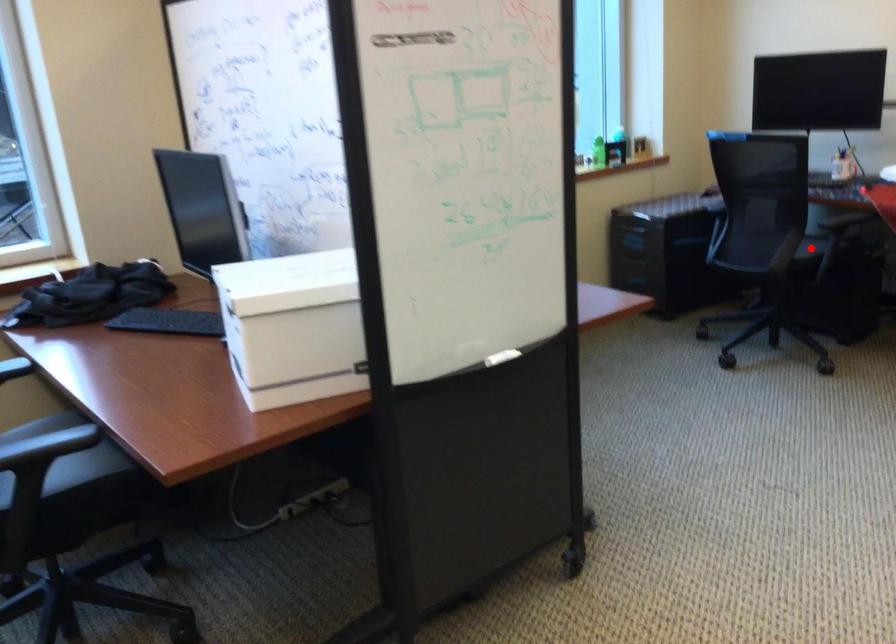
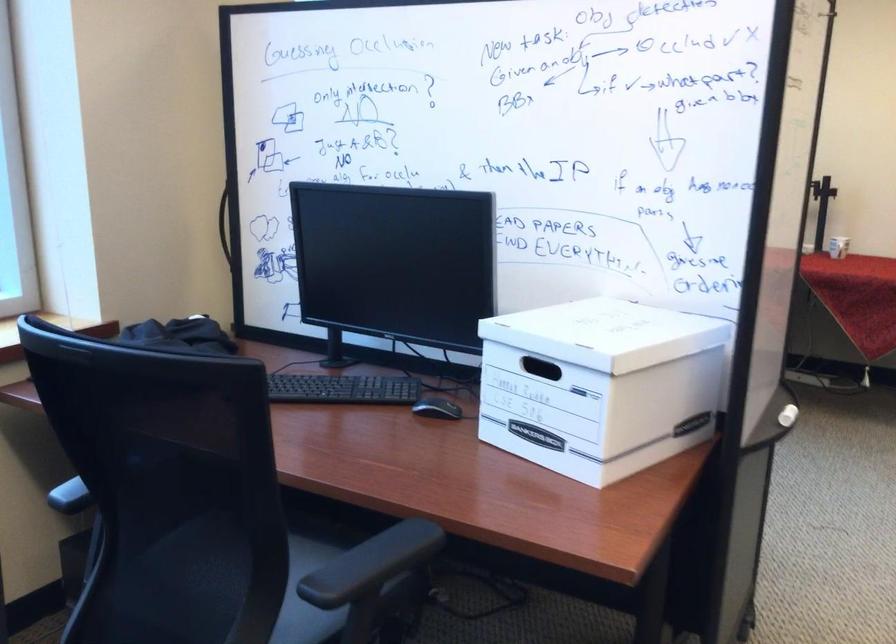
Question: I am providing you with two images of the same scene from different viewpoints. A red point is marked on the first image. Can you still see the location of the red point in image 2?

Choices:
 (A) Yes
 (B) No

Answer: (B)